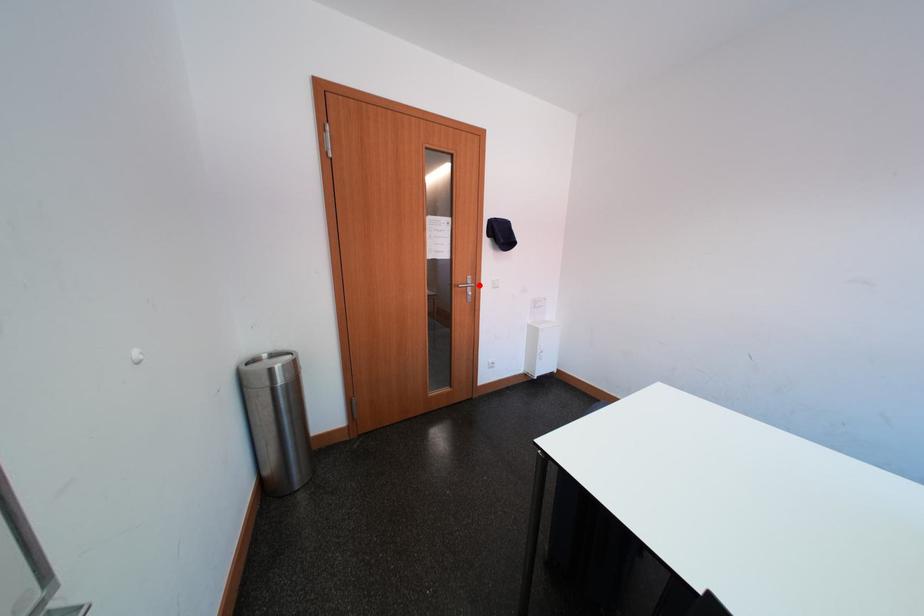
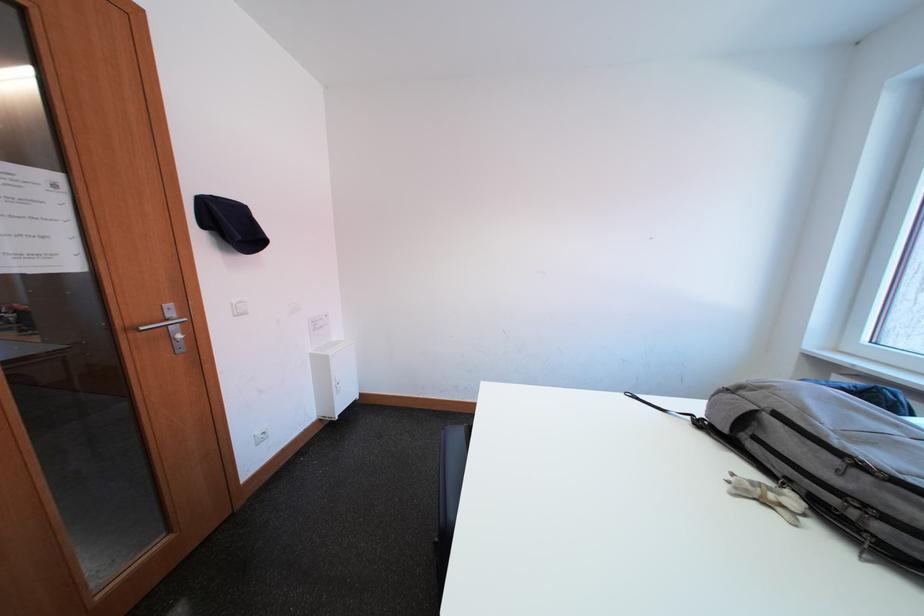
Locate, in the second image, the point that corresponds to the highlighted location in the first image.

(180, 317)